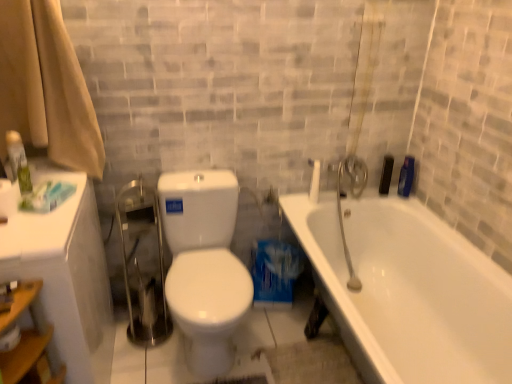
This screenshot has width=512, height=384. Identify the location of free space to the left of black plastic razor at upper right, the 2th toiletry positioned from the left. (360, 194).